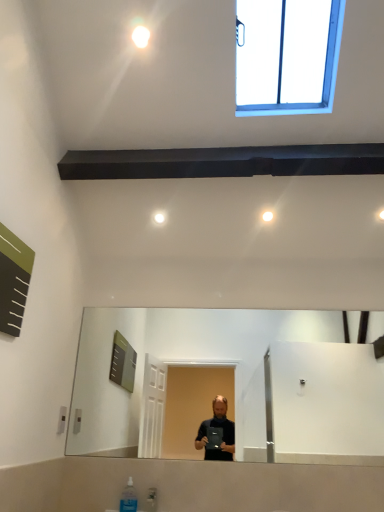
What do you see at coordinates (140, 36) in the screenshot? This screenshot has height=512, width=384. I see `white glossy light bulb at upper center` at bounding box center [140, 36].

Where is `white glossy light bulb at upper center`? The image size is (384, 512). white glossy light bulb at upper center is located at coordinates (140, 36).

Image resolution: width=384 pixels, height=512 pixels. Identify the location of blue plastic window at upper right. (287, 56).

In order to face clear plastic bottle at lower center, should I rotate leftwards or rightwards?

To align with it, rotate left about 8.085°.

Identify the location of white glossy light bulb at upper center. (140, 36).

From a real-world perspective, relative to white glossy light bulb at upper center, is blue plastic window at upper right vertically above or below?

From a real-world perspective, blue plastic window at upper right is physically above white glossy light bulb at upper center.

Is blue plastic window at upper right facing away from white glossy light bulb at upper center?

No, blue plastic window at upper right's orientation is not away from white glossy light bulb at upper center.

Measure the distance between blue plastic window at upper right and white glossy light bulb at upper center.

blue plastic window at upper right is 1.92 meters away from white glossy light bulb at upper center.

Consider the image. Considering the sizes of blue plastic window at upper right and white glossy light bulb at upper center in the image, is blue plastic window at upper right taller or shorter than white glossy light bulb at upper center?

In the image, blue plastic window at upper right appears to be taller than white glossy light bulb at upper center.

Is clear plastic bottle at lower center bigger or smaller than white glossy light bulb at upper center?

clear plastic bottle at lower center is bigger than white glossy light bulb at upper center.

From the image's perspective, between clear plastic bottle at lower center and white glossy light bulb at upper center, which one is located above?

white glossy light bulb at upper center appears higher in the image.

Is the surface of clear plastic bottle at lower center in direct contact with white glossy light bulb at upper center?

No, clear plastic bottle at lower center is not next to white glossy light bulb at upper center.

How many degrees apart are the facing directions of green matte board at upper left and blue plastic window at upper right?

There is a 90.3-degree angle between the facing directions of green matte board at upper left and blue plastic window at upper right.

Which object is positioned more to the right, green matte board at upper left or blue plastic window at upper right?

From the viewer's perspective, blue plastic window at upper right appears more on the right side.

Which point is more forward, (x=0, y=233) or (x=314, y=78)?

The point (x=0, y=233) is closer.

Is green matte board at upper left taller or shorter than blue plastic window at upper right?

Considering their sizes, green matte board at upper left has less height than blue plastic window at upper right.

Does clear plastic bottle at lower center turn towards blue plastic window at upper right?

No, clear plastic bottle at lower center is not aimed at blue plastic window at upper right.

Do you think clear plastic bottle at lower center is within blue plastic window at upper right, or outside of it?

clear plastic bottle at lower center is outside blue plastic window at upper right.

Based on the photo, from the image's perspective, relative to blue plastic window at upper right, is clear plastic bottle at lower center above or below?

From the image's perspective, clear plastic bottle at lower center appears below blue plastic window at upper right.

Is clear plastic bottle at lower center next to blue plastic window at upper right?

No, clear plastic bottle at lower center is not in contact with blue plastic window at upper right.

Where is `lighting behind the green matte board at upper left`? lighting behind the green matte board at upper left is located at coordinates (140, 36).

From the image's perspective, between green matte board at upper left and white glossy light bulb at upper center, who is located below?

green matte board at upper left.

Is green matte board at upper left next to white glossy light bulb at upper center?

No, green matte board at upper left is not in contact with white glossy light bulb at upper center.

How many degrees apart are the facing directions of green matte board at upper left and white glossy light bulb at upper center?

90.3 degrees separate the facing orientations of green matte board at upper left and white glossy light bulb at upper center.

Considering the relative positions of white glossy light bulb at upper center and blue plastic window at upper right in the image provided, is white glossy light bulb at upper center to the left or to the right of blue plastic window at upper right?

From the image, it's evident that white glossy light bulb at upper center is to the left of blue plastic window at upper right.

Is point (139, 47) farther from viewer compared to point (241, 38)?

That is False.

Based on the photo, from the image's perspective, between white glossy light bulb at upper center and blue plastic window at upper right, who is located below?

From the image's view, white glossy light bulb at upper center is below.

Does green matte board at upper left lie in front of clear plastic bottle at lower center?

Yes, green matte board at upper left is in front of clear plastic bottle at lower center.

Is green matte board at upper left positioned with its back to clear plastic bottle at lower center?

No, green matte board at upper left is not facing the opposite direction of clear plastic bottle at lower center.

From the image's perspective, which one is positioned lower, green matte board at upper left or clear plastic bottle at lower center?

clear plastic bottle at lower center is shown below in the image.

Where is `bulletin board on the left of clear plastic bottle at lower center`? This screenshot has height=512, width=384. bulletin board on the left of clear plastic bottle at lower center is located at coordinates (13, 280).

At what (x,y) coordinates should I click in order to perform the action: click on lighting lying on the left of blue plastic window at upper right. Please return your answer as a coordinate pair (x, y). This screenshot has height=512, width=384. Looking at the image, I should click on (140, 36).

In order to click on toiletry that is below the white glossy light bulb at upper center (from the image's perspective) in this screenshot , I will do `click(128, 498)`.

Looking at the image, which one is located closer to blue plastic window at upper right, clear plastic bottle at lower center or green matte board at upper left?

The object closer to blue plastic window at upper right is green matte board at upper left.

When comparing their distances from green matte board at upper left, does clear plastic bottle at lower center or white glossy light bulb at upper center seem further?

Based on the image, clear plastic bottle at lower center appears to be further to green matte board at upper left.

When comparing their distances from blue plastic window at upper right, does clear plastic bottle at lower center or white glossy light bulb at upper center seem closer?

white glossy light bulb at upper center lies closer to blue plastic window at upper right than the other object.

Looking at the image, which one is located further to clear plastic bottle at lower center, blue plastic window at upper right or green matte board at upper left?

blue plastic window at upper right is further to clear plastic bottle at lower center.

Looking at the image, which one is located further to clear plastic bottle at lower center, green matte board at upper left or white glossy light bulb at upper center?

white glossy light bulb at upper center is positioned further to the anchor clear plastic bottle at lower center.

From the image, which object appears to be nearer to green matte board at upper left, blue plastic window at upper right or white glossy light bulb at upper center?

white glossy light bulb at upper center lies closer to green matte board at upper left than the other object.

Looking at this image, estimate the real-world distances between objects in this image. Which object is closer to white glossy light bulb at upper center, green matte board at upper left or clear plastic bottle at lower center?

The object closer to white glossy light bulb at upper center is green matte board at upper left.

When comparing their distances from blue plastic window at upper right, does white glossy light bulb at upper center or clear plastic bottle at lower center seem further?

clear plastic bottle at lower center is further to blue plastic window at upper right.

You are a GUI agent. You are given a task and a screenshot of the screen. Output one action in this format:
    pyautogui.click(x=<x>, y=<y>)
    Task: Click on the bulletin board that lies between white glossy light bulb at upper center and clear plastic bottle at lower center from top to bottom
    
    Given the screenshot: What is the action you would take?
    pyautogui.click(x=13, y=280)

Find the location of a particular element. lighting that lies between blue plastic window at upper right and green matte board at upper left from top to bottom is located at coordinates (140, 36).

This screenshot has height=512, width=384. Identify the location of lighting between blue plastic window at upper right and clear plastic bottle at lower center vertically. (140, 36).

Where is `bulletin board between blue plastic window at upper right and clear plastic bottle at lower center in the up-down direction`? The image size is (384, 512). bulletin board between blue plastic window at upper right and clear plastic bottle at lower center in the up-down direction is located at coordinates (13, 280).